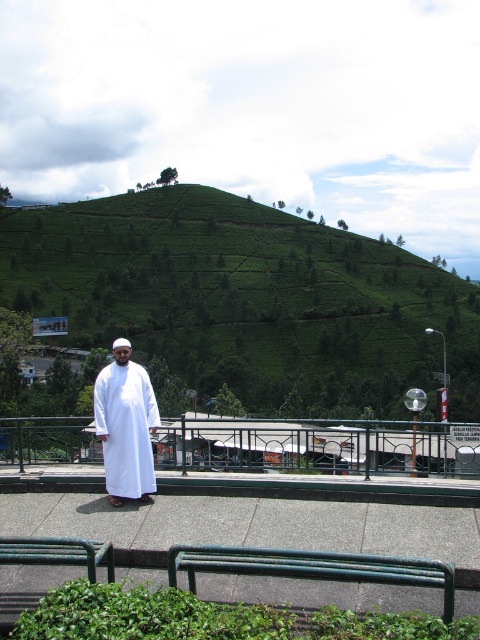
You are a photographer standing on the walkway and want to capture a photo of the white cotton robe at center and the green leafy hillside at upper center. Which object should you focus on first if you want to ensure both are in the frame?

The photographer should focus on the white cotton robe at center first since the green leafy hillside at upper center is above it, ensuring both are within the frame by adjusting the camera angle upwards.

You are standing at the point marked by the coordinates point (247, 300). Looking around, you see the green leafy hillside at upper center and the person dressed in traditional white attire. Which direction should you walk to reach the person?

The point (247, 300) marks the green leafy hillside at upper center, which is above the person dressed in traditional white attire. To reach the person, you should walk downward from the point (247, 300) towards the lower part of the image where the person is located.

You are a photographer planning to capture a wide shot of the green leafy hillside at upper center and the white cotton robe at center. Based on their widths, which object should you prioritize framing first to ensure both fit in the frame?

The green leafy hillside at upper center is wider than the white cotton robe at center, so you should prioritize framing the green leafy hillside at upper center first to ensure both fit in the frame.